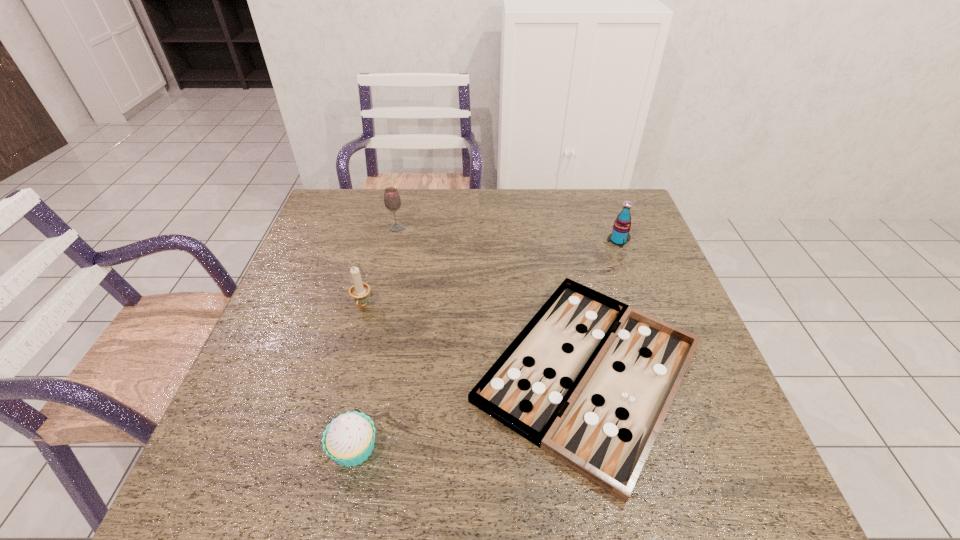
Where is `glass drink container`? The image size is (960, 540). glass drink container is located at coordinates (392, 201).

Locate an element on the screen. the fourth nearest object is located at coordinates (620, 235).

The image size is (960, 540). Find the location of `candle_holder`. candle_holder is located at coordinates 359,291.

I want to click on cupcake, so coord(349,439).

At what (x,y) coordinates should I click in order to perform the action: click on gameboard. Please return your answer as a coordinate pair (x, y). This screenshot has width=960, height=540. Looking at the image, I should click on (589, 380).

Find the location of a particular element. vacant position located 0.360m on the right of the glass drink container is located at coordinates (520, 228).

This screenshot has height=540, width=960. I want to click on vacant area situated on the left of the soda, so click(561, 241).

You are a GUI agent. You are given a task and a screenshot of the screen. Output one action in this format:
    pyautogui.click(x=<x>, y=<y>)
    Task: Click on the free space located 0.180m on the handle side of the candle_holder
    This screenshot has height=540, width=960.
    Given the screenshot: What is the action you would take?
    pyautogui.click(x=344, y=376)

This screenshot has height=540, width=960. Find the location of `free location located 0.190m on the right of the fourth tallest object`. free location located 0.190m on the right of the fourth tallest object is located at coordinates (477, 448).

The width and height of the screenshot is (960, 540). I want to click on vacant space located 0.150m on the left of the gameboard, so click(x=401, y=372).